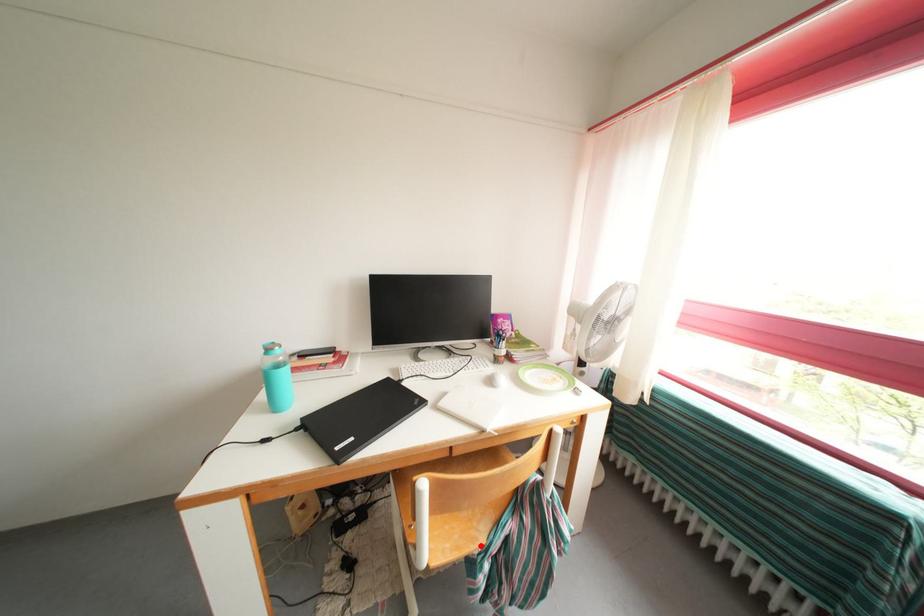
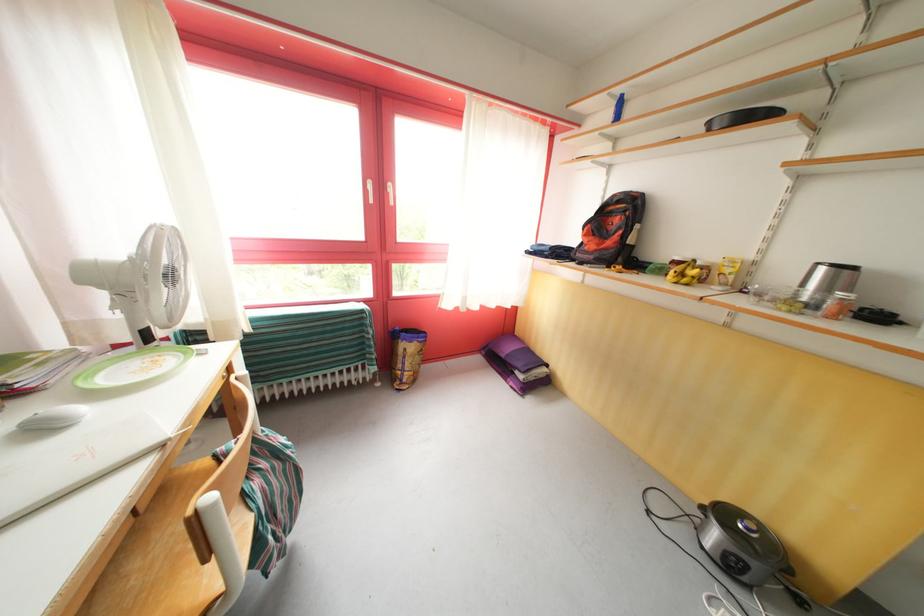
Find the pixel in the second image that matches the highlighted location in the first image.

(251, 535)